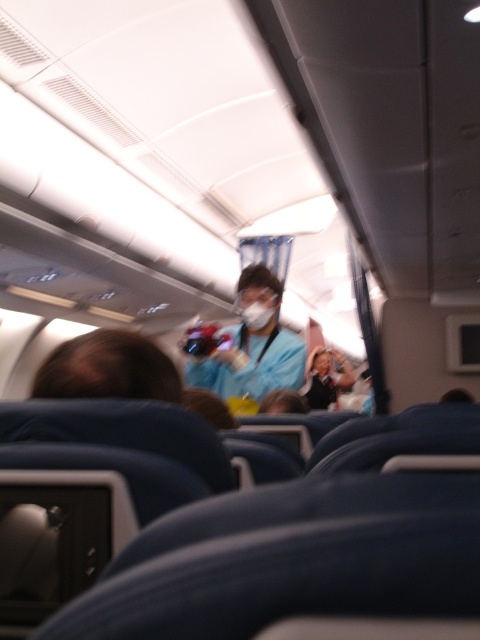
Question: Can you confirm if matte blue uniform at center is smaller than white matte mask at center?

Choices:
 (A) no
 (B) yes

Answer: (A)

Question: Considering the relative positions of matte blue uniform at center and white matte mask at center in the image provided, where is matte blue uniform at center located with respect to white matte mask at center?

Choices:
 (A) above
 (B) below

Answer: (B)

Question: Which point is farther to the camera?

Choices:
 (A) white matte mask at center
 (B) matte blue uniform at center

Answer: (A)

Question: Which point appears farthest from the camera in this image?

Choices:
 (A) (267, 385)
 (B) (262, 300)

Answer: (B)

Question: Which object appears closest to the camera in this image?

Choices:
 (A) white matte mask at center
 (B) matte blue uniform at center

Answer: (B)

Question: Does matte blue uniform at center have a lesser width compared to white matte mask at center?

Choices:
 (A) yes
 (B) no

Answer: (B)